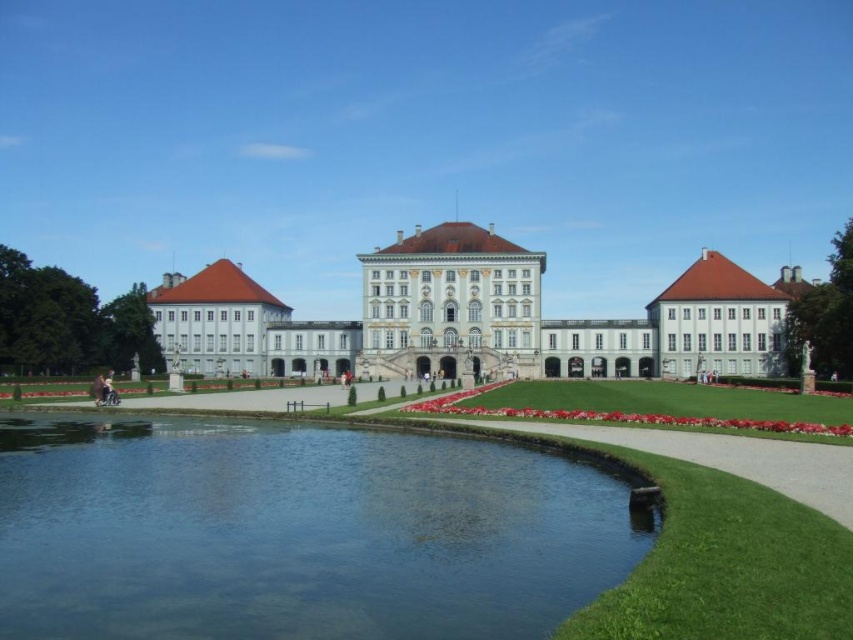
You are standing at the central entrance of the palace and looking towards the garden. There is a point marked at coordinates (294, 532). What is located at this point?

The point at (294, 532) marks clear water at bottom center.

You are standing in front of the palace and want to take a photo that includes both the palace and the clear water at bottom center. If your camera has a maximum focus range of 70 meters, will you be able to capture both in focus?

The clear water at bottom center is 68.82 meters from the camera, which is within the camera maximum focus range of 70 meters. Therefore, you can capture both the palace and the clear water at bottom center in focus.